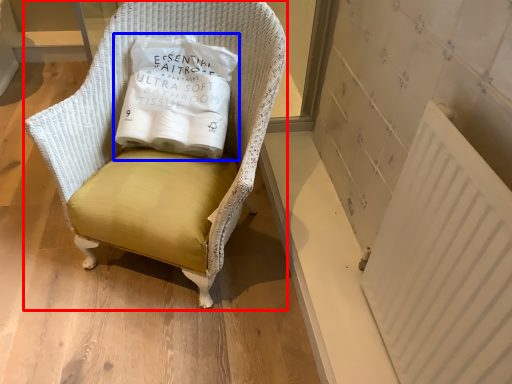
Question: Which of the following is the farthest to the observer, chair (highlighted by a red box) or pillow (highlighted by a blue box)?

Choices:
 (A) chair
 (B) pillow

Answer: (B)